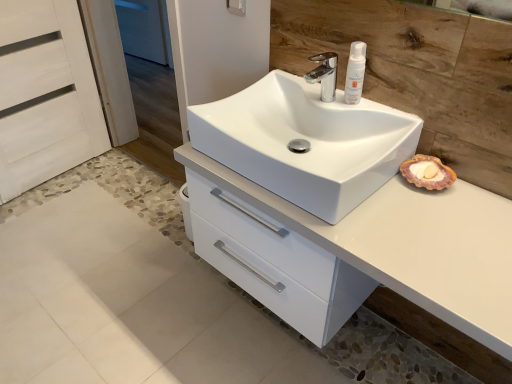
The height and width of the screenshot is (384, 512). Find the location of `white matte lotion at upper right`. white matte lotion at upper right is located at coordinates (355, 73).

What do you see at coordinates (133, 94) in the screenshot? The width and height of the screenshot is (512, 384). I see `white wood screen door at left, acting as the second screen door starting from the left` at bounding box center [133, 94].

What do you see at coordinates (305, 142) in the screenshot? The width and height of the screenshot is (512, 384). I see `white glossy sink at center` at bounding box center [305, 142].

You are a GUI agent. You are given a task and a screenshot of the screen. Output one action in this format:
    pyautogui.click(x=<x>, y=<y>)
    Task: Click on the white glossy cabinet at center
    Image resolution: width=512 pixels, height=384 pixels.
    Given the screenshot: What is the action you would take?
    pyautogui.click(x=411, y=245)

The image size is (512, 384). I want to click on white wood screen door at left, which is counted as the 2th screen door, starting from the right, so 45,94.

The height and width of the screenshot is (384, 512). Identify the location of chrome metallic faucet at upper center. (324, 75).

Identify the location of white matte lotion at upper right. (355, 73).

Can you confirm if white glossy sink at center is wider than white matte lotion at upper right?

Indeed, white glossy sink at center has a greater width compared to white matte lotion at upper right.

From the image's perspective, is white glossy sink at center positioned above or below white matte lotion at upper right?

From the image's perspective, white glossy sink at center appears below white matte lotion at upper right.

Is white glossy sink at center in contact with white matte lotion at upper right?

No.

From the picture: Is white wood screen door at left, which appears as the 1th screen door when viewed from the right, touching white matte lotion at upper right?

There is a gap between white wood screen door at left, which appears as the 1th screen door when viewed from the right, and white matte lotion at upper right.

Is white wood screen door at left, which appears as the 1th screen door when viewed from the right, taller or shorter than white matte lotion at upper right?

Considering their sizes, white wood screen door at left, which appears as the 1th screen door when viewed from the right, has more height than white matte lotion at upper right.

Is white wood screen door at left, acting as the second screen door starting from the left, oriented towards white matte lotion at upper right?

No, white wood screen door at left, acting as the second screen door starting from the left, is not turned towards white matte lotion at upper right.

Which is farther from the camera, (x=131, y=139) or (x=353, y=103)?

Positioned behind is point (x=131, y=139).

Does white wood screen door at left, which is counted as the 2th screen door, starting from the right, have a smaller size compared to white glossy cabinet at center?

Correct, white wood screen door at left, which is counted as the 2th screen door, starting from the right, occupies less space than white glossy cabinet at center.

Considering the points (10, 112) and (476, 238), which point is in front, point (10, 112) or point (476, 238)?

The point (476, 238) is closer.

How distant is white wood screen door at left, arranged as the 1th screen door when viewed from the left, from white glossy cabinet at center?

white wood screen door at left, arranged as the 1th screen door when viewed from the left, is 1.58 meters away from white glossy cabinet at center.

From the image's perspective, is white wood screen door at left, which is counted as the 2th screen door, starting from the right, located above white glossy cabinet at center?

Yes, from the image's perspective, white wood screen door at left, which is counted as the 2th screen door, starting from the right, is above white glossy cabinet at center.

Is white glossy sink at center aimed at white wood screen door at left, acting as the second screen door starting from the left?

→ No, white glossy sink at center is not facing towards white wood screen door at left, acting as the second screen door starting from the left.

Between white glossy sink at center and white wood screen door at left, acting as the second screen door starting from the left, which one has larger width?

With larger width is white glossy sink at center.

Is white glossy sink at center shorter than white wood screen door at left, acting as the second screen door starting from the left?

Indeed, white glossy sink at center has a lesser height compared to white wood screen door at left, acting as the second screen door starting from the left.

From a real-world perspective, is white glossy sink at center physically located above or below white wood screen door at left, which appears as the 1th screen door when viewed from the right?

white glossy sink at center is situated higher than white wood screen door at left, which appears as the 1th screen door when viewed from the right, in the real world.

Would you consider chrome metallic faucet at upper center to be distant from white matte lotion at upper right?

No.

Is white matte lotion at upper right at the back of chrome metallic faucet at upper center?

That's not correct — chrome metallic faucet at upper center is not looking away from white matte lotion at upper right.

In order to click on toiletry to the right of chrome metallic faucet at upper center in this screenshot , I will do `click(355, 73)`.

Can you tell me how much chrome metallic faucet at upper center and white matte lotion at upper right differ in facing direction?

The facing directions of chrome metallic faucet at upper center and white matte lotion at upper right are 2.51 degrees apart.

Is chrome metallic faucet at upper center spatially inside white wood screen door at left, which is counted as the 2th screen door, starting from the right, or outside of it?

chrome metallic faucet at upper center is spatially situated outside white wood screen door at left, which is counted as the 2th screen door, starting from the right.

In the image, there is a white wood screen door at left, which is counted as the 2th screen door, starting from the right. Identify the location of tap below it (from the image's perspective). (324, 75).

Considering the relative positions of chrome metallic faucet at upper center and white wood screen door at left, arranged as the 1th screen door when viewed from the left, in the image provided, is chrome metallic faucet at upper center to the right of white wood screen door at left, arranged as the 1th screen door when viewed from the left, from the viewer's perspective?

Yes.

Which of these two, chrome metallic faucet at upper center or white wood screen door at left, arranged as the 1th screen door when viewed from the left, is bigger?

With larger size is white wood screen door at left, arranged as the 1th screen door when viewed from the left.

Is white wood screen door at left, which is counted as the 2th screen door, starting from the right, wider than white wood screen door at left, acting as the second screen door starting from the left?

Incorrect, the width of white wood screen door at left, which is counted as the 2th screen door, starting from the right, does not surpass that of white wood screen door at left, acting as the second screen door starting from the left.

From a real-world perspective, which object stands above the other?

white wood screen door at left, which appears as the 1th screen door when viewed from the right, from a real-world perspective.

Can you tell me how much white wood screen door at left, arranged as the 1th screen door when viewed from the left, and white wood screen door at left, which appears as the 1th screen door when viewed from the right, differ in facing direction?

The facing directions of white wood screen door at left, arranged as the 1th screen door when viewed from the left, and white wood screen door at left, which appears as the 1th screen door when viewed from the right, are 93.3 degrees apart.

In terms of height, does white wood screen door at left, arranged as the 1th screen door when viewed from the left, look taller or shorter compared to white wood screen door at left, which appears as the 1th screen door when viewed from the right?

white wood screen door at left, arranged as the 1th screen door when viewed from the left, is shorter than white wood screen door at left, which appears as the 1th screen door when viewed from the right.

You are a GUI agent. You are given a task and a screenshot of the screen. Output one action in this format:
    pyautogui.click(x=<x>, y=<y>)
    Task: Click on the sink on the left of white matte lotion at upper right
    Image resolution: width=512 pixels, height=384 pixels.
    Given the screenshot: What is the action you would take?
    pyautogui.click(x=305, y=142)

Locate an element on the screen. This screenshot has width=512, height=384. toiletry on the right of white wood screen door at left, acting as the second screen door starting from the left is located at coordinates (355, 73).

From the picture: Considering their positions, is white glossy sink at center positioned further to white wood screen door at left, which is counted as the 2th screen door, starting from the right, than white glossy cabinet at center?

white glossy cabinet at center.

From the image, which object appears to be nearer to white matte lotion at upper right, white wood screen door at left, which appears as the 1th screen door when viewed from the right, or chrome metallic faucet at upper center?

chrome metallic faucet at upper center is closer to white matte lotion at upper right.

Considering their positions, is chrome metallic faucet at upper center positioned further to white glossy cabinet at center than white glossy sink at center?

Among the two, chrome metallic faucet at upper center is located further to white glossy cabinet at center.

Considering their positions, is white glossy sink at center positioned closer to white matte lotion at upper right than white glossy cabinet at center?

white glossy sink at center is positioned closer to the anchor white matte lotion at upper right.

Estimate the real-world distances between objects in this image. Which object is further from white glossy sink at center, white wood screen door at left, which is counted as the 2th screen door, starting from the right, or white glossy cabinet at center?

white wood screen door at left, which is counted as the 2th screen door, starting from the right, is further to white glossy sink at center.

When comparing their distances from white glossy sink at center, does white matte lotion at upper right or white wood screen door at left, which is counted as the 2th screen door, starting from the right, seem further?

Based on the image, white wood screen door at left, which is counted as the 2th screen door, starting from the right, appears to be further to white glossy sink at center.

In the scene shown: From the image, which object appears to be farther from white wood screen door at left, which is counted as the 2th screen door, starting from the right, white wood screen door at left, acting as the second screen door starting from the left, or chrome metallic faucet at upper center?

chrome metallic faucet at upper center is positioned further to the anchor white wood screen door at left, which is counted as the 2th screen door, starting from the right.

From the picture: Looking at the image, which one is located closer to white matte lotion at upper right, white wood screen door at left, acting as the second screen door starting from the left, or white glossy sink at center?

white glossy sink at center is positioned closer to the anchor white matte lotion at upper right.

Find the location of a particular element. bathroom cabinet between white wood screen door at left, which is counted as the 2th screen door, starting from the right, and white matte lotion at upper right is located at coordinates (411, 245).

At what (x,y) coordinates should I click in order to perform the action: click on tap between white wood screen door at left, which is counted as the 2th screen door, starting from the right, and white matte lotion at upper right, in the horizontal direction. Please return your answer as a coordinate pair (x, y). The width and height of the screenshot is (512, 384). Looking at the image, I should click on (324, 75).

Locate an element on the screen. sink located between white wood screen door at left, acting as the second screen door starting from the left, and white matte lotion at upper right in the left-right direction is located at coordinates (305, 142).

The width and height of the screenshot is (512, 384). Find the location of `screen door situated between white wood screen door at left, arranged as the 1th screen door when viewed from the left, and white glossy sink at center from left to right`. screen door situated between white wood screen door at left, arranged as the 1th screen door when viewed from the left, and white glossy sink at center from left to right is located at coordinates (133, 94).